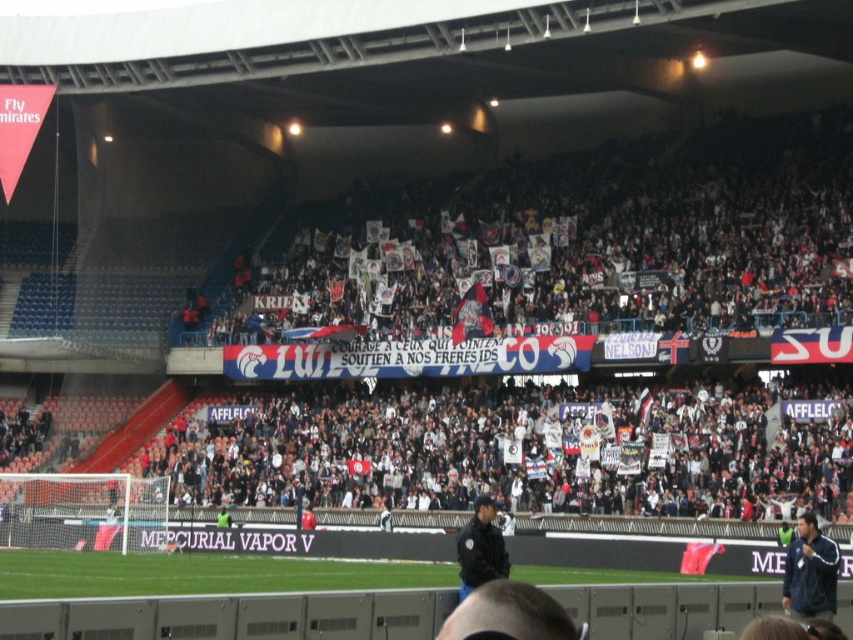
You are a photographer positioned at the edge of the soccer field. You need to capture a photo that includes both the blue fabric jacket at lower right and the black uniform at center. Based on their positions, which one should you adjust your camera angle to focus on first to ensure both are in frame?

The blue fabric jacket at lower right is to the right of the black uniform at center. To include both in the frame, you should first focus on the black uniform at center and then adjust your angle to include the blue fabric jacket at lower right, which is positioned further to the right.

You are a photographer standing at the camera position in the stadium. You want to take a photo of the blue fabric jacket at lower right. Is the jacket within the standard 50 meter range of your camera lens?

The blue fabric jacket at lower right is 36.58 meters from camera, so yes, it is within the standard 50 meter range of your camera lens.

You are a photographer positioned at the center of the soccer field during a match. You want to take a photo of the blue fabric jacket at lower right. Based on the coordinates provided, in which direction should you move to capture the jacket in your shot?

The blue fabric jacket at lower right is located at point (x=810, y=572). Since you are at the center of the field, you should move towards the lower right direction to capture the jacket in your shot.